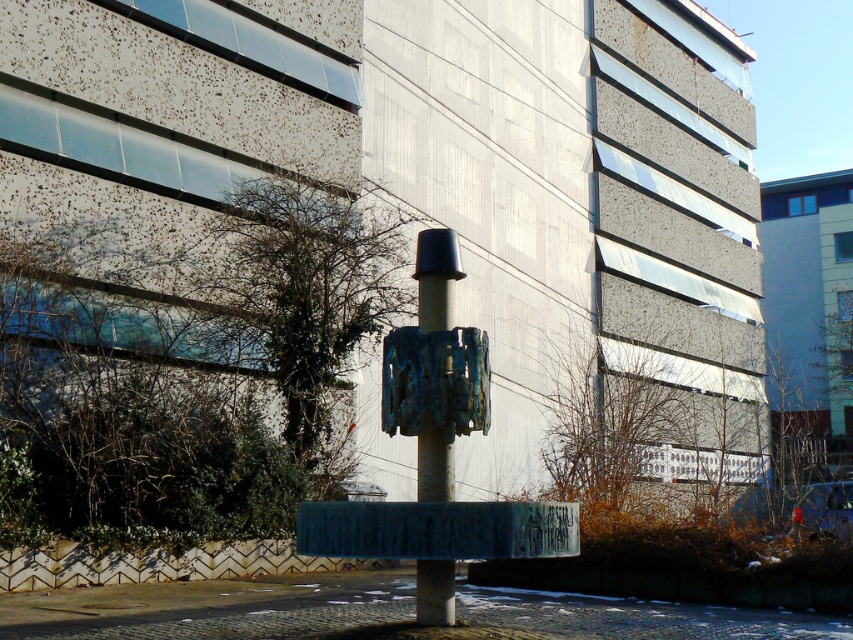
Question: Can you confirm if green painted concrete at center is positioned above bronze textured sculpture at center?

Choices:
 (A) yes
 (B) no

Answer: (B)

Question: Which of the following is the closest to the observer?

Choices:
 (A) (387, 540)
 (B) (428, 593)

Answer: (A)

Question: Can you confirm if green painted concrete at center is bigger than bronze textured sculpture at center?

Choices:
 (A) yes
 (B) no

Answer: (A)

Question: Is green painted concrete at center smaller than bronze textured sculpture at center?

Choices:
 (A) yes
 (B) no

Answer: (B)

Question: Which point is closer to the camera?

Choices:
 (A) bronze textured sculpture at center
 (B) green painted concrete at center

Answer: (B)